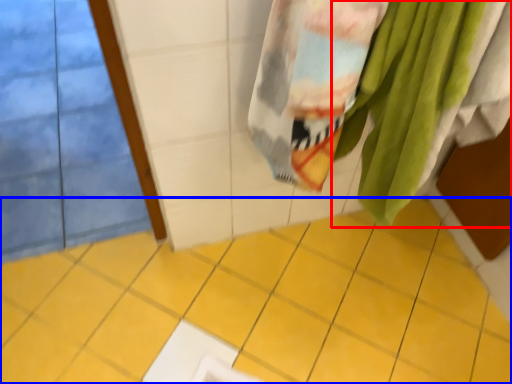
Question: Which object appears closest to the camera in this image, towel (highlighted by a red box) or ceramic tile (highlighted by a blue box)?

Choices:
 (A) towel
 (B) ceramic tile

Answer: (A)